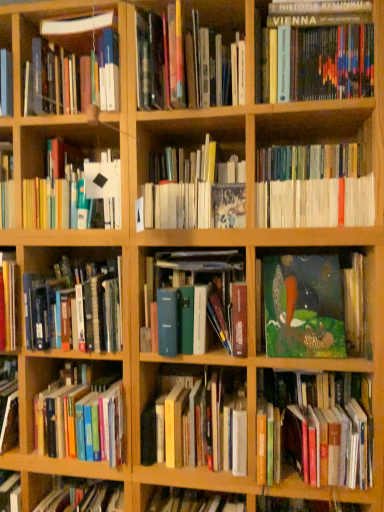
Question: From a real-world perspective, is hardcover book at center, arranged as the second book when ordered from the bottom, positioned under green matte painting at center right, which is counted as the tenth book, starting from the top, based on gravity?

Choices:
 (A) no
 (B) yes

Answer: (B)

Question: Can you confirm if hardcover book at center, positioned as the eleventh book in top-to-bottom order, is shorter than green matte painting at center right, which is counted as the tenth book, starting from the top?

Choices:
 (A) no
 (B) yes

Answer: (B)

Question: Is hardcover book at center, positioned as the eleventh book in top-to-bottom order, outside green matte painting at center right, which is counted as the tenth book, starting from the top?

Choices:
 (A) yes
 (B) no

Answer: (A)

Question: Could you tell me if hardcover book at center, arranged as the second book when ordered from the bottom, is turned towards green matte painting at center right, the third book in the bottom-to-top sequence?

Choices:
 (A) yes
 (B) no

Answer: (B)

Question: Is hardcover book at center, arranged as the second book when ordered from the bottom, bigger than green matte painting at center right, the third book in the bottom-to-top sequence?

Choices:
 (A) no
 (B) yes

Answer: (B)

Question: From their relative heights in the image, would you say white matte book at upper left, the fifth book positioned from the top, is taller or shorter than oil painting at center, the fifth book in the bottom-to-top sequence?

Choices:
 (A) tall
 (B) short

Answer: (B)

Question: Would you say white matte book at upper left, which appears as the eighth book when ordered from the bottom, is to the left or to the right of oil painting at center, the fifth book in the bottom-to-top sequence, in the picture?

Choices:
 (A) left
 (B) right

Answer: (A)

Question: Does point (56, 219) appear closer or farther from the camera than point (359, 345)?

Choices:
 (A) closer
 (B) farther

Answer: (B)

Question: Looking at the image, does white matte book at upper left, which appears as the eighth book when ordered from the bottom, seem bigger or smaller compared to oil painting at center, the fifth book in the bottom-to-top sequence?

Choices:
 (A) small
 (B) big

Answer: (B)

Question: Is hardcover book at upper center, which is the 1th book from top to bottom, in front of or behind hardcover book at upper left, positioned as the eleventh book in bottom-to-top order, in the image?

Choices:
 (A) behind
 (B) front

Answer: (B)

Question: Is hardcover book at upper center, arranged as the 12th book when ordered from the bottom, wider or thinner than hardcover book at upper left, positioned as the eleventh book in bottom-to-top order?

Choices:
 (A) thin
 (B) wide

Answer: (B)

Question: Is hardcover book at upper center, arranged as the 12th book when ordered from the bottom, spatially inside hardcover book at upper left, marked as the second book in a top-to-bottom arrangement, or outside of it?

Choices:
 (A) inside
 (B) outside

Answer: (B)

Question: Looking at the image, does hardcover book at upper center, which is the 1th book from top to bottom, seem bigger or smaller compared to hardcover book at upper left, positioned as the eleventh book in bottom-to-top order?

Choices:
 (A) big
 (B) small

Answer: (A)

Question: From their relative heights in the image, would you say blue hardcover book at center, the fourth book in the bottom-to-top sequence, is taller or shorter than hardcover book at center, positioned as the eleventh book in top-to-bottom order?

Choices:
 (A) short
 (B) tall

Answer: (B)

Question: Relative to hardcover book at center, arranged as the second book when ordered from the bottom, is blue hardcover book at center, which ranks as the ninth book in top-to-bottom order, in front or behind?

Choices:
 (A) behind
 (B) front

Answer: (B)